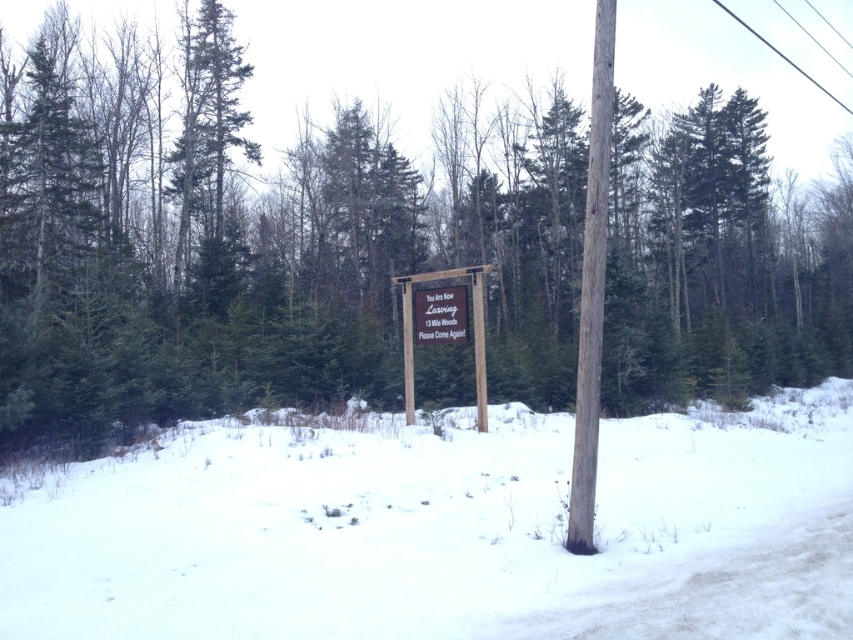
Does smooth brown wood at right have a larger size compared to brown wooden sign at center?

Yes, smooth brown wood at right is bigger than brown wooden sign at center.

The width and height of the screenshot is (853, 640). I want to click on smooth brown wood at right, so click(592, 289).

This screenshot has width=853, height=640. What are the coordinates of `smooth brown wood at right` in the screenshot? It's located at (592, 289).

Find the location of a particular element. The width and height of the screenshot is (853, 640). white fluffy snow at lower center is located at coordinates (445, 529).

Who is more forward, (674, 556) or (450, 292)?

Point (674, 556) is more forward.

The width and height of the screenshot is (853, 640). What do you see at coordinates (445, 529) in the screenshot? I see `white fluffy snow at lower center` at bounding box center [445, 529].

Identify the location of white fluffy snow at lower center. This screenshot has width=853, height=640. (x=445, y=529).

Is smooth brown wood at right above metallic silver sign at center?

Yes.

Which is in front, point (599, 22) or point (428, 289)?

Point (599, 22) is in front.

Locate an element on the screen. smooth brown wood at right is located at coordinates (592, 289).

Identify the location of smooth brown wood at right. (592, 289).